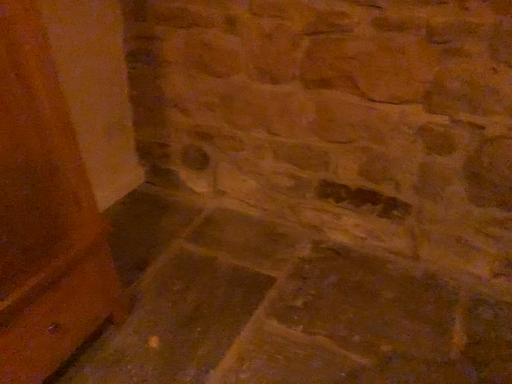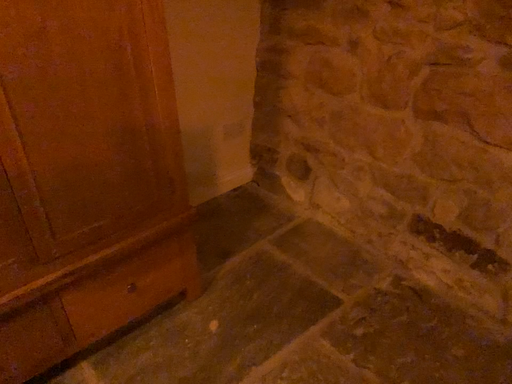
Question: How did the camera likely rotate when shooting the video?

Choices:
 (A) rotated left
 (B) rotated right

Answer: (A)